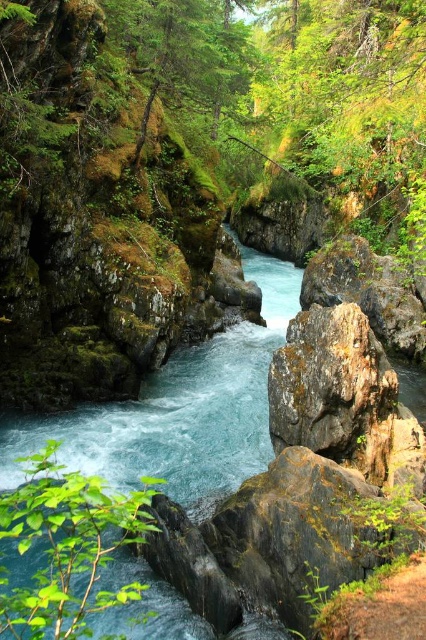
Does green leafy branch at lower left have a greater width compared to rusty stone boulder at center-right?

In fact, green leafy branch at lower left might be narrower than rusty stone boulder at center-right.

What do you see at coordinates (66, 545) in the screenshot?
I see `green leafy branch at lower left` at bounding box center [66, 545].

Locate an element on the screen. green leafy branch at lower left is located at coordinates (66, 545).